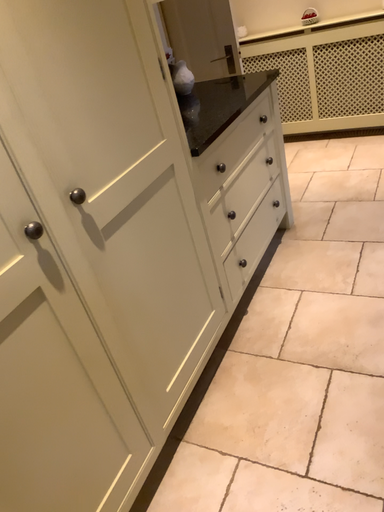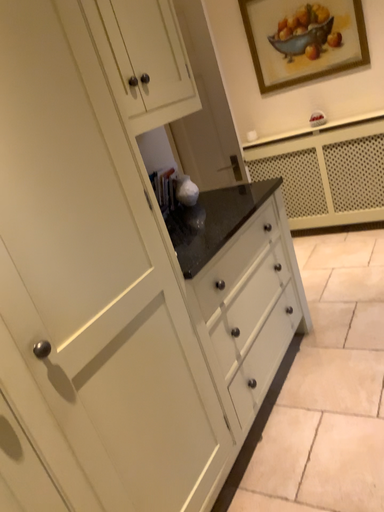
Question: Which way did the camera rotate in the video?

Choices:
 (A) rotated upward
 (B) rotated downward

Answer: (A)